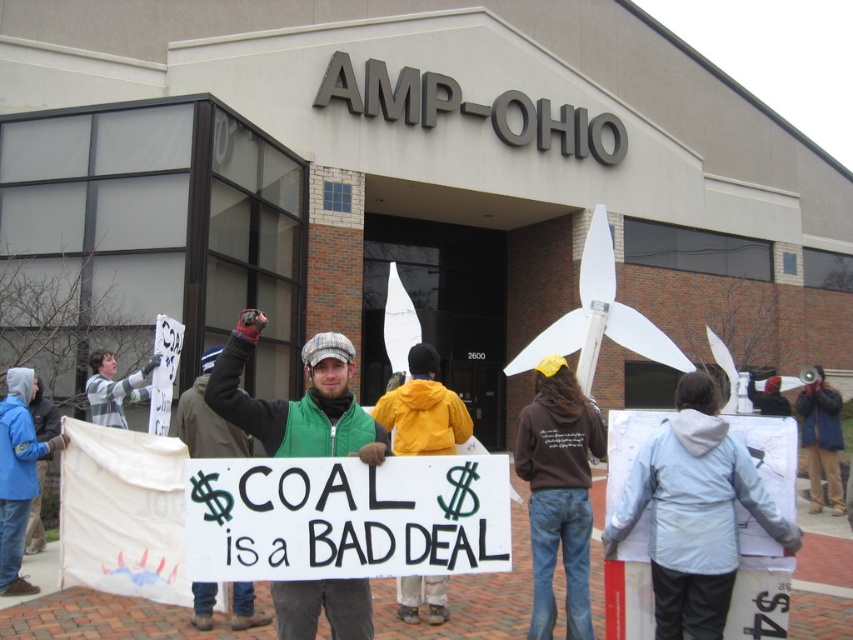
Question: Which of the following is the closest to the observer?

Choices:
 (A) (21, 397)
 (B) (335, 461)
 (C) (346, 627)
 (D) (657, 490)

Answer: (B)

Question: Does white paper sign at center have a greater width compared to green fabric jacket at center?

Choices:
 (A) no
 (B) yes

Answer: (B)

Question: Among these points, which one is nearest to the camera?

Choices:
 (A) pos(260,620)
 (B) pos(189,502)

Answer: (B)

Question: Which point appears closest to the camera in this image?

Choices:
 (A) (283, 419)
 (B) (38, 452)

Answer: (A)

Question: Can you confirm if yellow jacket at center is positioned above green fabric jacket at center?

Choices:
 (A) no
 (B) yes

Answer: (B)

Question: In this image, where is brown hoodie at center located relative to green fabric jacket at center?

Choices:
 (A) right
 (B) left

Answer: (A)